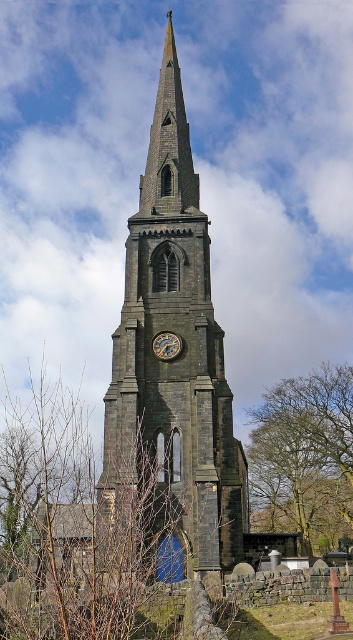
Question: Which object is the closest to the gold metallic clock at center?

Choices:
 (A) dark gray stone clock tower at center
 (B) bare branches at center

Answer: (A)

Question: Considering the relative positions of bare branches at center and gold metallic clock at center in the image provided, where is bare branches at center located with respect to gold metallic clock at center?

Choices:
 (A) above
 (B) below

Answer: (B)

Question: Is bare branches at center to the right of gold metallic clock at center from the viewer's perspective?

Choices:
 (A) yes
 (B) no

Answer: (A)

Question: Which object is the closest to the gold metallic clock at center?

Choices:
 (A) dark gray stone clock tower at center
 (B) bare branches at center

Answer: (A)

Question: Which point is closer to the camera?

Choices:
 (A) bare branches at center
 (B) dark gray stone clock tower at center
 (C) gold metallic clock at center

Answer: (B)

Question: Observing the image, what is the correct spatial positioning of dark gray stone clock tower at center in reference to gold metallic clock at center?

Choices:
 (A) below
 (B) above

Answer: (B)